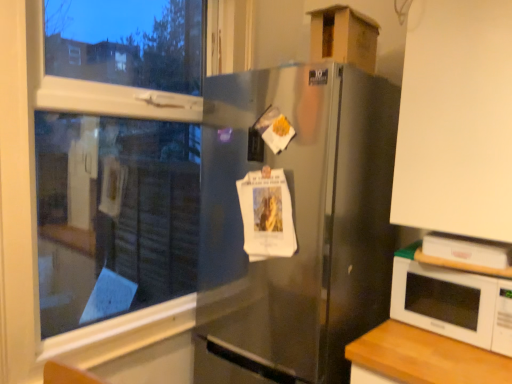
Question: Could you tell me if white glossy microwave at lower right is facing white matte cabinet at upper right?

Choices:
 (A) no
 (B) yes

Answer: (A)

Question: Is white glossy microwave at lower right positioned before white matte cabinet at upper right?

Choices:
 (A) yes
 (B) no

Answer: (B)

Question: From the image's perspective, is white glossy microwave at lower right below white matte cabinet at upper right?

Choices:
 (A) no
 (B) yes

Answer: (B)

Question: Does white glossy microwave at lower right have a smaller size compared to white matte cabinet at upper right?

Choices:
 (A) yes
 (B) no

Answer: (A)

Question: Can you confirm if white glossy microwave at lower right is taller than white matte cabinet at upper right?

Choices:
 (A) no
 (B) yes

Answer: (A)

Question: Is white glossy microwave at lower right directly adjacent to white matte cabinet at upper right?

Choices:
 (A) no
 (B) yes

Answer: (A)

Question: Is transparent glass window at upper left aimed at white matte cabinet at upper right?

Choices:
 (A) yes
 (B) no

Answer: (A)

Question: Is white matte cabinet at upper right located within transparent glass window at upper left?

Choices:
 (A) no
 (B) yes

Answer: (A)

Question: Is transparent glass window at upper left positioned with its back to white matte cabinet at upper right?

Choices:
 (A) yes
 (B) no

Answer: (B)

Question: Considering the relative sizes of transparent glass window at upper left and white matte cabinet at upper right in the image provided, is transparent glass window at upper left taller than white matte cabinet at upper right?

Choices:
 (A) yes
 (B) no

Answer: (A)

Question: Are transparent glass window at upper left and white matte cabinet at upper right beside each other?

Choices:
 (A) no
 (B) yes

Answer: (A)

Question: Is transparent glass window at upper left shorter than white matte cabinet at upper right?

Choices:
 (A) yes
 (B) no

Answer: (B)

Question: Is cardboard box at upper right aimed at white matte cabinet at upper right?

Choices:
 (A) yes
 (B) no

Answer: (B)